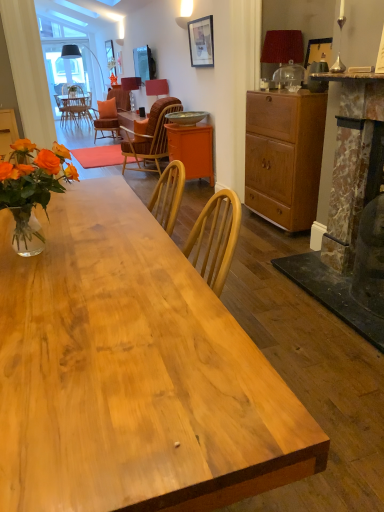
The width and height of the screenshot is (384, 512). What are the coordinates of `orange matte cabinet at center, arranged as the second cabinetry when viewed from the right` in the screenshot? It's located at (192, 149).

Locate an element on the screen. The height and width of the screenshot is (512, 384). marble fireplace at right is located at coordinates (347, 76).

Identify the location of matte wood cabinet at right, which is the second cabinetry from left to right. (284, 156).

Describe the element at coordinates (150, 137) in the screenshot. This screenshot has height=512, width=384. I see `yellow wood chair at center` at that location.

Measure the distance between yellow wood chair at center and camera.

The depth of yellow wood chair at center is 4.82 meters.

Locate an element on the screen. Image resolution: width=384 pixels, height=512 pixels. natural wood desk at center is located at coordinates (132, 373).

Consider the image. Are natural wood desk at center and matte orange lampshade at center, which is the 3th lamp in front-to-back order, located far from each other?

Yes, natural wood desk at center and matte orange lampshade at center, which is the 3th lamp in front-to-back order, are located far from each other.

Can you confirm if natural wood desk at center is smaller than matte orange lampshade at center, acting as the first lamp starting from the top?

No.

How different are the orientations of natural wood desk at center and matte orange lampshade at center, the 3th lamp from the bottom, in degrees?

The facing directions of natural wood desk at center and matte orange lampshade at center, the 3th lamp from the bottom, are 91.8 degrees apart.

Which object is thinner, natural wood desk at center or matte orange lampshade at center, marked as the first lamp in a left-to-right arrangement?

matte orange lampshade at center, marked as the first lamp in a left-to-right arrangement, is thinner.

Measure the distance from matte black picture frame at upper center to matte wood cabinet at right, which is the second cabinetry from back to front.

5.03 feet.

Does matte black picture frame at upper center have a lesser height compared to matte wood cabinet at right, acting as the first cabinetry starting from the right?

Correct, matte black picture frame at upper center is not as tall as matte wood cabinet at right, acting as the first cabinetry starting from the right.

Is matte black picture frame at upper center smaller than matte wood cabinet at right, which is the second cabinetry from back to front?

Correct, matte black picture frame at upper center occupies less space than matte wood cabinet at right, which is the second cabinetry from back to front.

From the image's perspective, is matte black picture frame at upper center located above matte wood cabinet at right, marked as the 1th cabinetry in a front-to-back arrangement?

Yes, from the image's perspective, matte black picture frame at upper center is over matte wood cabinet at right, marked as the 1th cabinetry in a front-to-back arrangement.

This screenshot has width=384, height=512. I want to click on desk in front of the matte orange lampshade at upper center, which is the 2th lamp from bottom to top, so click(132, 373).

From their relative heights in the image, would you say natural wood desk at center is taller or shorter than matte orange lampshade at upper center, the 2th lamp positioned from the left?

Considering their sizes, natural wood desk at center has more height than matte orange lampshade at upper center, the 2th lamp positioned from the left.

Is natural wood desk at center aimed at matte orange lampshade at upper center, which is the second lamp in top-to-bottom order?

Yes, natural wood desk at center is aimed at matte orange lampshade at upper center, which is the second lamp in top-to-bottom order.

From the image's perspective, is natural wood desk at center on top of matte orange lampshade at upper center, arranged as the 2th lamp when viewed from the right?

No.

In terms of height, does matte orange lampshade at upper center, which is the second lamp in top-to-bottom order, look taller or shorter compared to metallic bowl at center?

matte orange lampshade at upper center, which is the second lamp in top-to-bottom order, is taller than metallic bowl at center.

Consider the image. Is matte orange lampshade at upper center, arranged as the 2th lamp when viewed from the right, outside of metallic bowl at center?

matte orange lampshade at upper center, arranged as the 2th lamp when viewed from the right, is positioned outside metallic bowl at center.

From a real-world perspective, is matte orange lampshade at upper center, which is the second lamp in top-to-bottom order, positioned over metallic bowl at center based on gravity?

Indeed, from a real-world perspective, matte orange lampshade at upper center, which is the second lamp in top-to-bottom order, stands above metallic bowl at center.

Which object is thinner, matte orange lampshade at upper center, which is the 2th lamp in front-to-back order, or metallic bowl at center?

With smaller width is matte orange lampshade at upper center, which is the 2th lamp in front-to-back order.

Starting from the matte black picture frame at upper center, which lamp is the 1st one to the left? Please provide its 2D coordinates.

[(156, 90)]

How different are the orientations of matte black picture frame at upper center and matte orange lampshade at upper center, arranged as the 2th lamp when viewed from the right, in degrees?

0.964 degrees.

Between matte black picture frame at upper center and matte orange lampshade at upper center, the 2th lamp positioned from the left, which one has larger width?

matte orange lampshade at upper center, the 2th lamp positioned from the left, is wider.

Considering the sizes of matte black picture frame at upper center and matte orange lampshade at upper center, which is the 2th lamp from bottom to top, in the image, is matte black picture frame at upper center taller or shorter than matte orange lampshade at upper center, which is the 2th lamp from bottom to top,?

matte black picture frame at upper center is shorter than matte orange lampshade at upper center, which is the 2th lamp from bottom to top.

Measure the distance from marble fireplace at right to natural wood desk at center.

1.85 meters.

Considering the sizes of objects marble fireplace at right and natural wood desk at center in the image provided, who is thinner, marble fireplace at right or natural wood desk at center?

marble fireplace at right.

From the image's perspective, is marble fireplace at right on top of natural wood desk at center?

Yes, from the image's perspective, marble fireplace at right is above natural wood desk at center.

Consider the image. From a real-world perspective, who is located higher, marble fireplace at right or natural wood desk at center?

From a 3D spatial view, marble fireplace at right is above.

From the picture: From the image's perspective, is yellow wood chair at center located above or below red fabric lampshade at upper right, which is the 1th lamp in right-to-left order?

Clearly, from the image's perspective, yellow wood chair at center is below red fabric lampshade at upper right, which is the 1th lamp in right-to-left order.

Does yellow wood chair at center lie in front of red fabric lampshade at upper right, which is counted as the 1th lamp, starting from the bottom?

No.

Would you say yellow wood chair at center is a long distance from red fabric lampshade at upper right, the first lamp in the front-to-back sequence?

That's right, there is a large distance between yellow wood chair at center and red fabric lampshade at upper right, the first lamp in the front-to-back sequence.

Does point (140, 170) lie behind point (277, 40)?

Yes, point (140, 170) is farther from viewer.

This screenshot has height=512, width=384. In order to click on the 2nd lamp to the left when counting from the natural wood desk at center in this screenshot , I will do `click(131, 83)`.

The image size is (384, 512). Identify the location of cabinetry that is in front of the matte black picture frame at upper center. (284, 156).

From the image, which object appears to be farther from matte black picture frame at upper center, yellow wood chair at center or matte orange lampshade at upper center, which is the 2th lamp in front-to-back order?

matte orange lampshade at upper center, which is the 2th lamp in front-to-back order.

Looking at the image, which one is located further to matte black picture frame at upper center, matte wood cabinet at right, acting as the first cabinetry starting from the right, or matte orange lampshade at center, the 3th lamp from the bottom?

matte orange lampshade at center, the 3th lamp from the bottom, is further to matte black picture frame at upper center.

From the image, which object appears to be farther from red fabric lampshade at upper right, arranged as the 3th lamp when viewed from the left, metallic bowl at center or marble fireplace at right?

metallic bowl at center is further to red fabric lampshade at upper right, arranged as the 3th lamp when viewed from the left.

Which object lies further to the anchor point metallic bowl at center, marble fireplace at right or matte wood cabinet at right, which is the second cabinetry from left to right?

Among the two, marble fireplace at right is located further to metallic bowl at center.

Estimate the real-world distances between objects in this image. Which object is closer to natural wood desk at center, orange matte cabinet at center, the 1th cabinetry in the back-to-front sequence, or matte orange lampshade at center, which is the 3th lamp in front-to-back order?

orange matte cabinet at center, the 1th cabinetry in the back-to-front sequence, lies closer to natural wood desk at center than the other object.

Looking at the image, which one is located further to red fabric lampshade at upper right, the first lamp in the front-to-back sequence, matte orange lampshade at center, the 3th lamp from the bottom, or natural wood desk at center?

matte orange lampshade at center, the 3th lamp from the bottom, is further to red fabric lampshade at upper right, the first lamp in the front-to-back sequence.

Considering their positions, is orange matte cabinet at center, the 1th cabinetry in the back-to-front sequence, positioned closer to matte black picture frame at upper center than metallic bowl at center?

metallic bowl at center is positioned closer to the anchor matte black picture frame at upper center.

Estimate the real-world distances between objects in this image. Which object is further from natural wood desk at center, matte black picture frame at upper center or matte wood cabinet at right, which is the second cabinetry from back to front?

matte black picture frame at upper center is further to natural wood desk at center.

Locate an element on the screen. Image resolution: width=384 pixels, height=512 pixels. round table between marble fireplace at right and yellow wood chair at center from front to back is located at coordinates (186, 117).

The image size is (384, 512). I want to click on cabinetry located between matte black picture frame at upper center and matte orange lampshade at upper center, the 2th lamp positioned from the left, in the depth direction, so click(192, 149).

Find the location of a particular element. Image resolution: width=384 pixels, height=512 pixels. round table positioned between natural wood desk at center and matte orange lampshade at center, marked as the first lamp in a left-to-right arrangement, from near to far is located at coordinates (186, 117).

Locate an element on the screen. picture frame located between red fabric lampshade at upper right, which is counted as the 1th lamp, starting from the bottom, and matte orange lampshade at upper center, which is the 2th lamp in front-to-back order, in the depth direction is located at coordinates (201, 42).